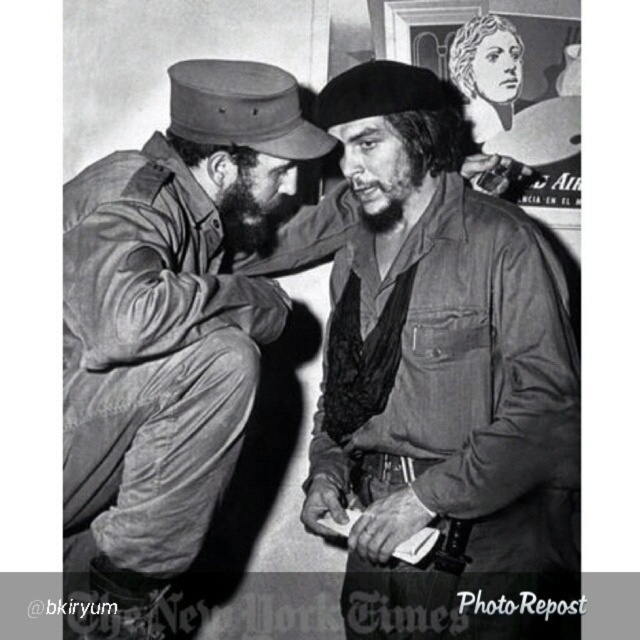
Question: Observing the image, what is the correct spatial positioning of dark brown leather jacket at center in reference to rugged canvas jacket at left?

Choices:
 (A) right
 (B) left

Answer: (A)

Question: Which object is closer to the camera taking this photo?

Choices:
 (A) black matte beard at center
 (B) dark brown leather jacket at center
 (C) rugged canvas jacket at left

Answer: (C)

Question: Where is dark brown leather jacket at center located in relation to rugged canvas jacket at left in the image?

Choices:
 (A) above
 (B) below

Answer: (A)

Question: Which of the following is the farthest from the observer?

Choices:
 (A) (156, 529)
 (B) (262, 241)
 (C) (406, 276)

Answer: (B)

Question: Considering the real-world distances, which object is farthest from the black matte beard at center?

Choices:
 (A) dark brown leather jacket at center
 (B) rugged canvas jacket at left

Answer: (A)

Question: From the image, what is the correct spatial relationship of rugged canvas jacket at left in relation to black matte beard at center?

Choices:
 (A) left
 (B) right

Answer: (A)